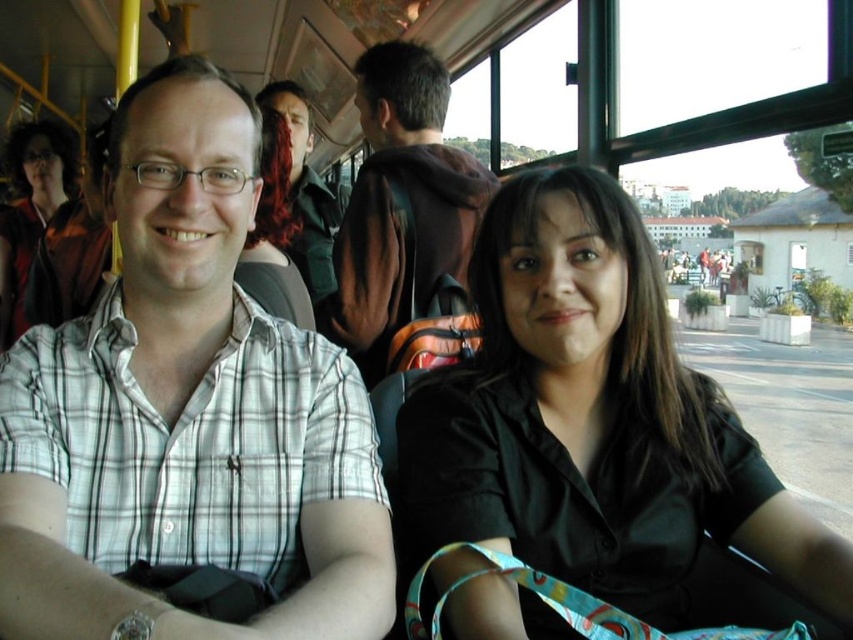
You are standing at the point marked as point (320,380) on the bus floor. You want to take a photo of the entire scene through the bus window. Is the distance between you and the camera sufficient to capture the two main passengers and the background passengers in the photo?

The distance between point (320,380) and the camera is 4.67 feet. This distance should be sufficient to capture both the two main passengers and the background passengers in the photo, as they are all within the same scene and the camera can likely capture the entire area from that vantage point.

You are standing at the back of the bus and want to reach the front. There are two points marked on the bus floor, point A at coordinates point [24,266] and point B at coordinates point [305,93]. Which point is closer to you as you start moving forward?

Point A at coordinates point [24,266] is closer to the viewer than point B at coordinates point [305,93], so point A is closer to you as you start moving forward.

From the picture: You are a passenger on the bus and want to take a photo of the two points mentioned in the scene. Which point, point (726, 481) or point (77, 180), will appear larger in your photo?

Point (726, 481) will appear larger in the photo because it is closer to the camera than point (77, 180).